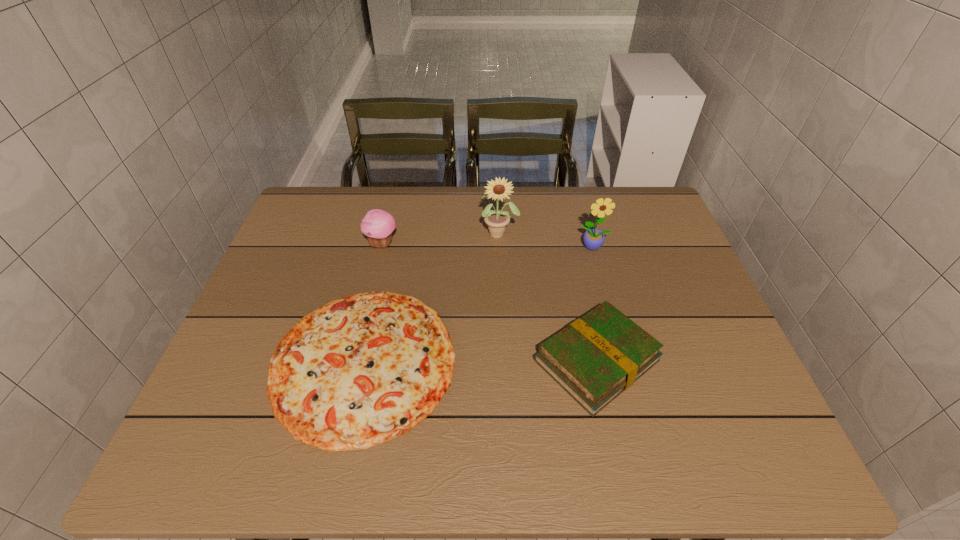
Find the location of a particular element. Image resolution: width=960 pixels, height=540 pixels. empty location between the pizza and the tallest object is located at coordinates (432, 298).

Where is `object that is the fourth nearest to the cupcake`? The width and height of the screenshot is (960, 540). object that is the fourth nearest to the cupcake is located at coordinates (593, 239).

The image size is (960, 540). What are the coordinates of `the closest object to the tallest object` in the screenshot? It's located at (593, 239).

You are a GUI agent. You are given a task and a screenshot of the screen. Output one action in this format:
    pyautogui.click(x=<x>, y=<y>)
    Task: Click on the vacant area that satisfies the following two spatial constraints: 1. on the front-facing side of the left sunflower; 2. on the left side of the book
    The width and height of the screenshot is (960, 540).
    Given the screenshot: What is the action you would take?
    pyautogui.click(x=505, y=360)